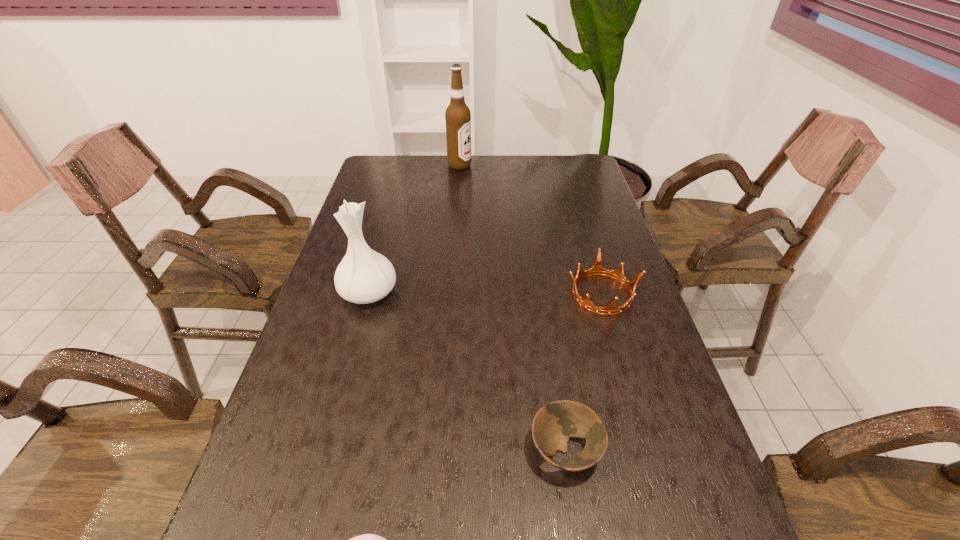
The width and height of the screenshot is (960, 540). Identify the location of free spot between the vase and the crown. (486, 293).

At what (x,y) coordinates should I click in order to perform the action: click on free spot between the crown and the farthest object. Please return your answer as a coordinate pair (x, y). This screenshot has height=540, width=960. Looking at the image, I should click on (531, 230).

At what (x,y) coordinates should I click in order to perform the action: click on vacant space in between the third object from left to right and the fourth farthest object. Please return your answer as a coordinate pair (x, y). The width and height of the screenshot is (960, 540). Looking at the image, I should click on (513, 308).

Select which object is the fourth closest to the vase. Please provide its 2D coordinates. Your answer should be formatted as a tuple, i.e. [(x, y)], where the tuple contains the x and y coordinates of a point satisfying the conditions above.

[(457, 115)]

Choose which object is the fourth nearest neighbor to the crown. Please provide its 2D coordinates. Your answer should be formatted as a tuple, i.e. [(x, y)], where the tuple contains the x and y coordinates of a point satisfying the conditions above.

[(457, 115)]

What are the coordinates of `vacant space that satisfies the following two spatial constraints: 1. on the label of the farthest object; 2. on the left side of the bowl` in the screenshot? It's located at (440, 450).

I want to click on vacant space that satisfies the following two spatial constraints: 1. on the label of the fourth farthest object; 2. on the right side of the tallest object, so click(x=440, y=450).